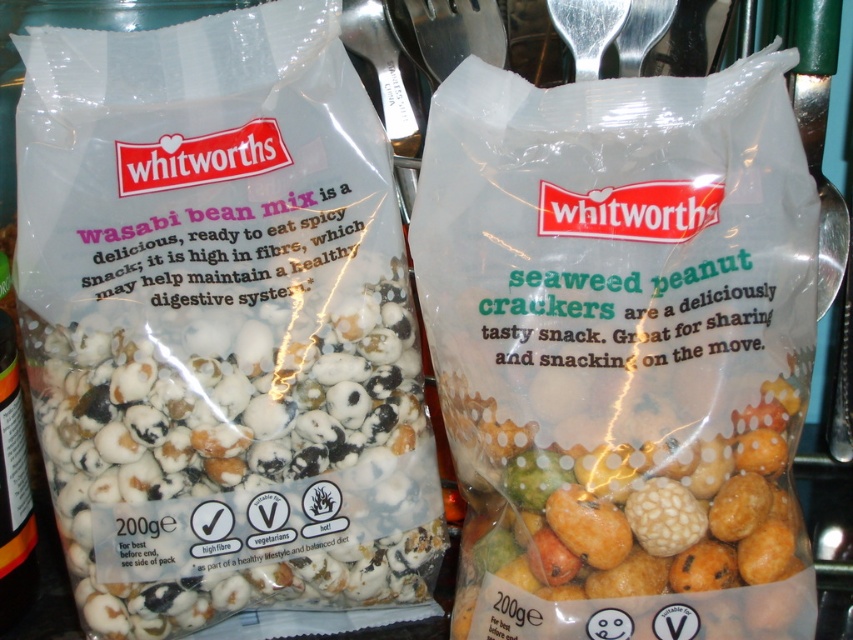
What do you see at coordinates (239, 461) in the screenshot? I see `white matte popcorn mix at left` at bounding box center [239, 461].

Does white matte popcorn mix at left appear on the left side of multicolored textured crackers at center?

Indeed, white matte popcorn mix at left is positioned on the left side of multicolored textured crackers at center.

The image size is (853, 640). I want to click on white matte popcorn mix at left, so click(x=239, y=461).

Identify the location of white matte popcorn mix at left. (239, 461).